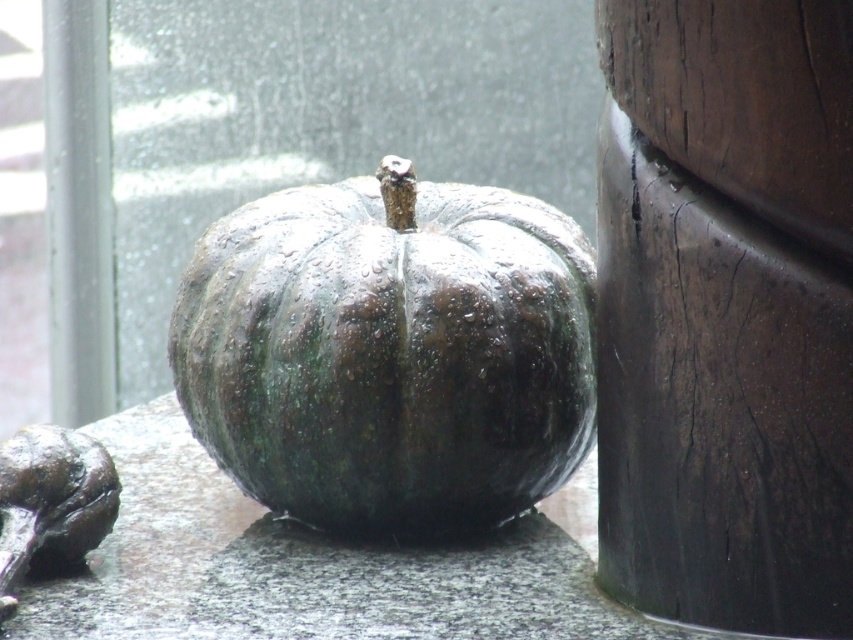
You are standing in front of a dark green, wet pumpkin on a stone surface. There are two points marked in the image. The first point is at coordinate point (x=689, y=234) and the second is at point (x=311, y=372). If you were to walk towards the dark wood to the right of the pumpkin, which point would you pass closer to first?

Point (x=689, y=234) is in front of point (x=311, y=372), so you would pass closer to point (x=689, y=234) first as you walk towards the dark wood to the right of the pumpkin.

You are standing in a room where the image is displayed. You need to place a small vase between the dark brown wood at right and the wet dark green pumpkin at center. Based on their positions, where should you place the vase?

The dark brown wood at right is located above the wet dark green pumpkin at center, so you should place the vase between them vertically. Position it below the dark brown wood at right and above the wet dark green pumpkin at center to ensure it is between both objects.